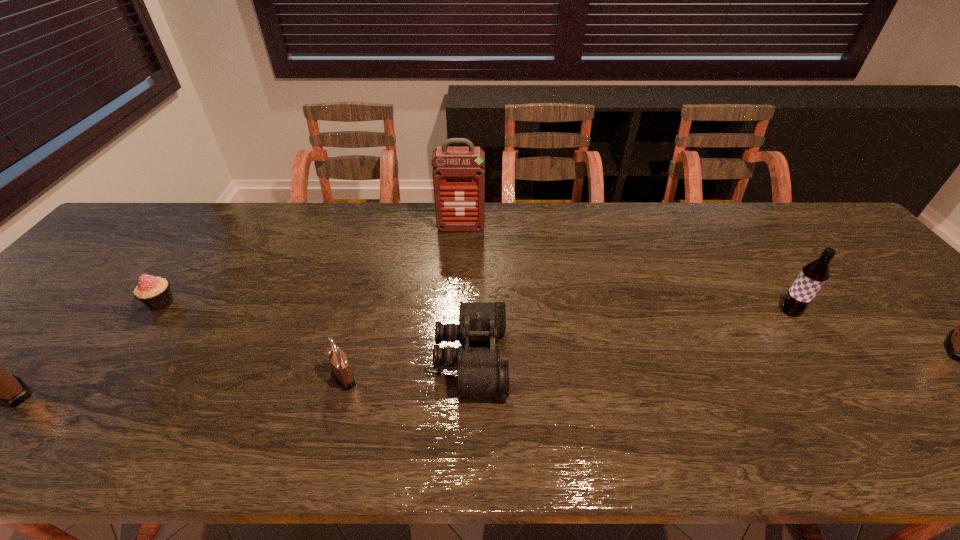
To ensure equal spacing by inserting another padlock among them, please point out a vacant spot for this new padlock. Please provide its 2D coordinates. Your answer should be formatted as a tuple, i.e. [(x, y)], where the tuple contains the x and y coordinates of a point satisfying the conditions above.

[(659, 362)]